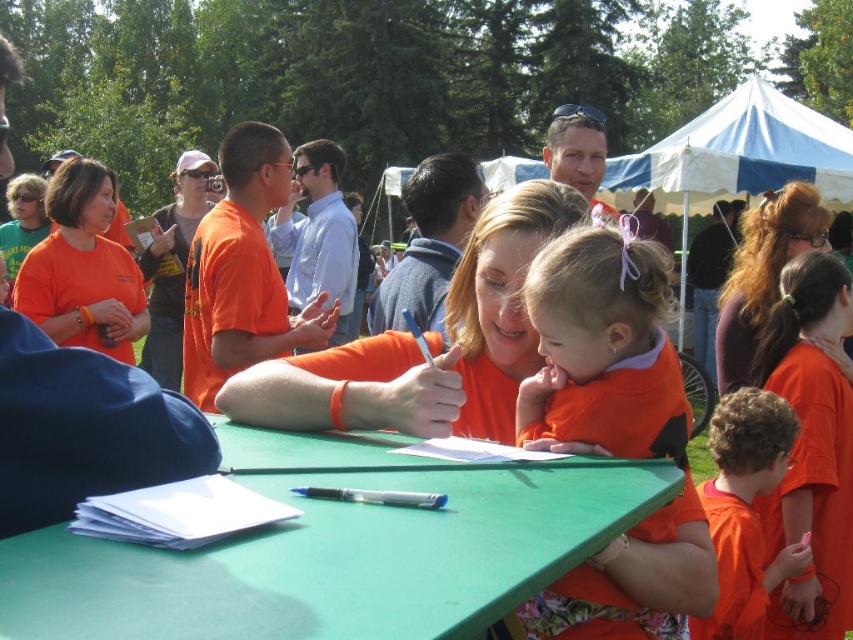
You are organizing a community event and need to place a 1.2 meter wide banner between the green plastic table at center and the orange matte shirt at lower right. Based on their widths, can the banner fit between them?

The green plastic table at center is wider than the orange matte shirt at lower right. Since the banner is 1.2 meters wide, it may not fit between them if the distance between the two objects is less than 1.2 meters. However, the provided information only states their widths, not the distance between them. Additional measurements are needed to determine if the banner can fit.

You are standing at the origin of the coordinate system in the image. You need to walk to point A located at point [606,320] and point B located at point [715,632]. Which point will you reach first?

Point A located at point [606,320] will be reached first because it is in front of point B located at point [715,632].

You are standing at the edge of the park and want to walk towards the two points marked in the image. Which point, point (488, 548) or point (606, 400), will you reach first?

Point (488, 548) is closer to the viewer than point (606, 400), so you will reach point (488, 548) first.